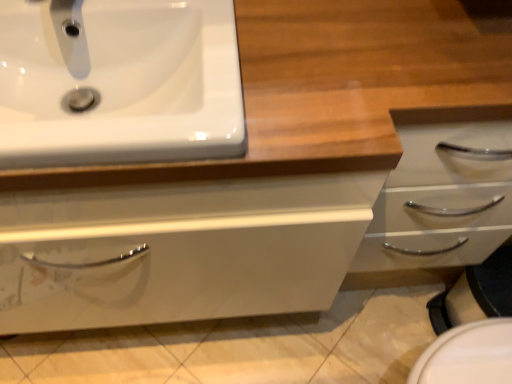
This screenshot has height=384, width=512. In order to click on vacant space to the right of matte white faucet at upper left in this screenshot , I will do `click(164, 20)`.